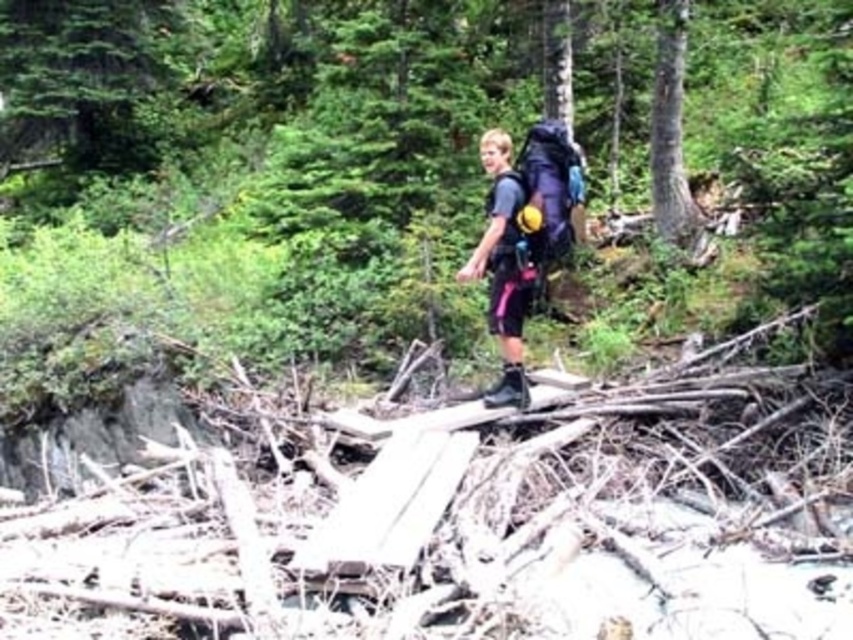
Can you confirm if dark gray fabric backpack at center is taller than black rubber boot at center?

Yes, dark gray fabric backpack at center is taller than black rubber boot at center.

Based on the photo, can you confirm if dark gray fabric backpack at center is thinner than black rubber boot at center?

Incorrect, dark gray fabric backpack at center's width is not less than black rubber boot at center's.

Does point (503, 150) lie behind point (512, 396)?

Yes, point (503, 150) is farther from viewer.

Locate an element on the screen. This screenshot has width=853, height=640. dark gray fabric backpack at center is located at coordinates (503, 268).